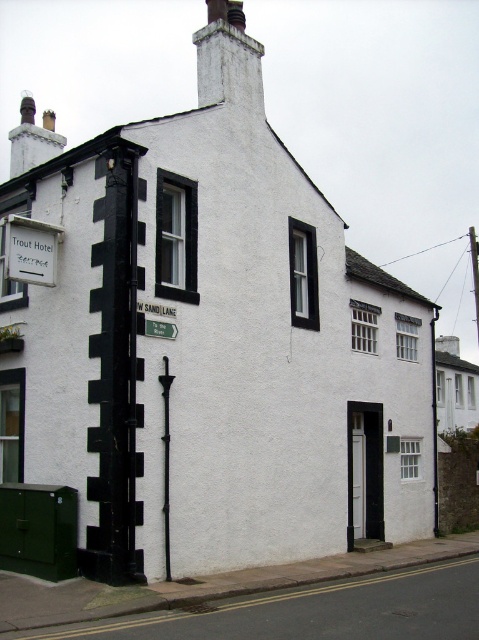
Question: Which point is farther from the camera taking this photo?

Choices:
 (A) (236, 26)
 (B) (166, 368)

Answer: (A)

Question: Among these points, which one is farthest from the camera?

Choices:
 (A) (237, 60)
 (B) (155, 323)
 (C) (172, 376)

Answer: (A)

Question: Which point appears farthest from the camera in this image?

Choices:
 (A) (164, 552)
 (B) (162, 328)

Answer: (B)

Question: Where is white painted brick chimney at upper center located in relation to green plastic street sign at lower left in the image?

Choices:
 (A) right
 (B) left

Answer: (B)

Question: Does white painted brick chimney at upper center appear on the right side of green plastic street sign at lower left?

Choices:
 (A) yes
 (B) no

Answer: (B)

Question: Can you confirm if white painted brick chimney at upper center is positioned below green plastic street sign at lower left?

Choices:
 (A) no
 (B) yes

Answer: (A)